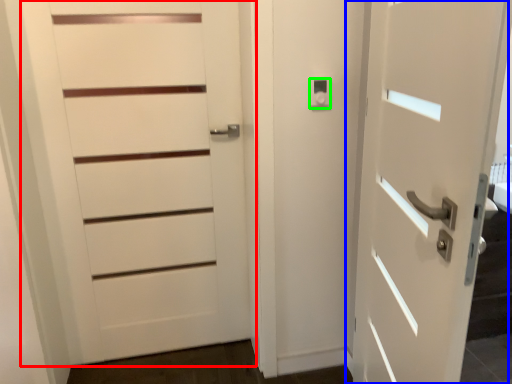
Question: Estimate the real-world distances between objects in this image. Which object is closer to door (highlighted by a red box), door (highlighted by a blue box) or knob (highlighted by a green box)?

Choices:
 (A) door
 (B) knob

Answer: (B)